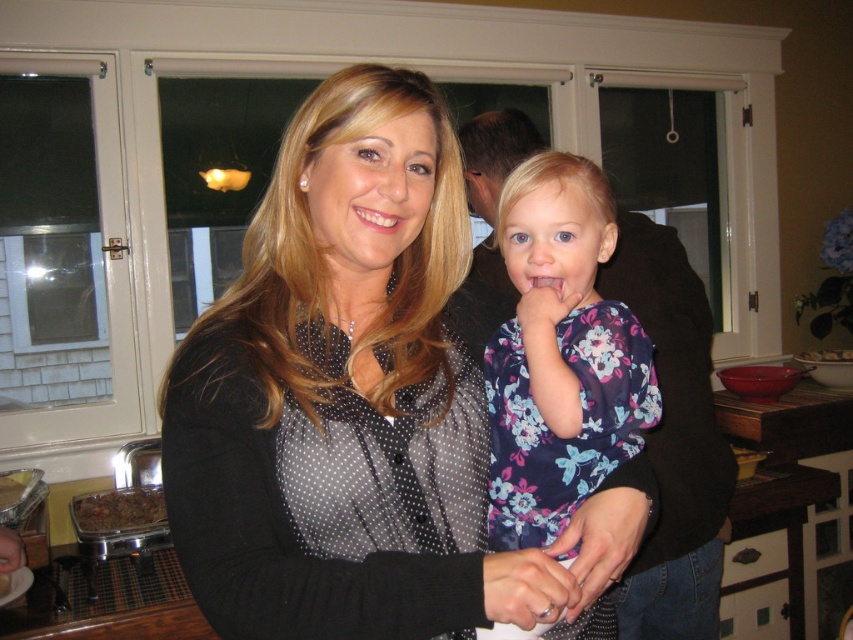
Question: Can you confirm if matte white teeth at center is positioned below white glossy bowl at upper right?

Choices:
 (A) no
 (B) yes

Answer: (A)

Question: Can you confirm if floral fabric shirt at center is positioned to the right of matte white teeth at center?

Choices:
 (A) no
 (B) yes

Answer: (B)

Question: Which object appears farthest from the camera in this image?

Choices:
 (A) floral fabric shirt at center
 (B) matte white teeth at center
 (C) brown crumbly food at lower left
 (D) black dotted shirt at center

Answer: (C)

Question: Does floral fabric shirt at center have a lesser width compared to brown crumbly food at lower left?

Choices:
 (A) yes
 (B) no

Answer: (A)

Question: Among these points, which one is farthest from the camera?

Choices:
 (A) (527, 326)
 (B) (142, 490)
 (C) (352, 592)
 (D) (358, 212)

Answer: (B)

Question: Which object is closer to the camera taking this photo?

Choices:
 (A) white glossy bowl at upper right
 (B) floral fabric shirt at center
 (C) matte white teeth at center
 (D) black dotted shirt at center

Answer: (D)